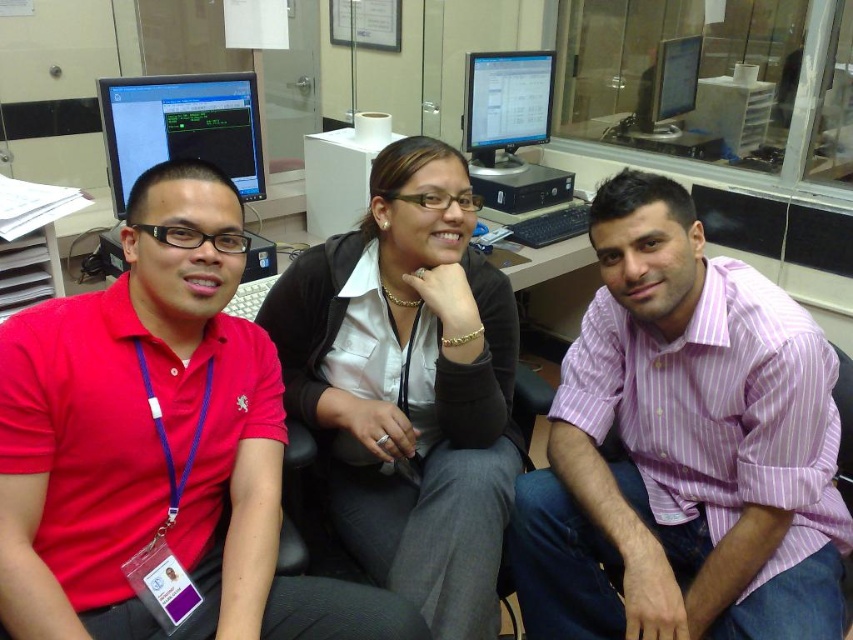
Question: Is matte red polo shirt at left smaller than black matte shirt at center?

Choices:
 (A) yes
 (B) no

Answer: (A)

Question: Which object is positioned closest to the matte black monitor at upper left?

Choices:
 (A) silver metallic monitor at upper right
 (B) matte red polo shirt at left
 (C) matte black monitor at center

Answer: (B)

Question: Which point is farther to the camera?

Choices:
 (A) black matte shirt at center
 (B) silver metallic monitor at upper right

Answer: (B)

Question: Does black matte shirt at center appear under silver metallic monitor at upper right?

Choices:
 (A) yes
 (B) no

Answer: (A)

Question: Which of the following is the closest to the observer?

Choices:
 (A) matte black monitor at center
 (B) matte red polo shirt at left
 (C) matte black monitor at upper left
 (D) silver metallic monitor at upper right

Answer: (B)

Question: Is matte black monitor at upper left above silver metallic monitor at upper right?

Choices:
 (A) yes
 (B) no

Answer: (B)